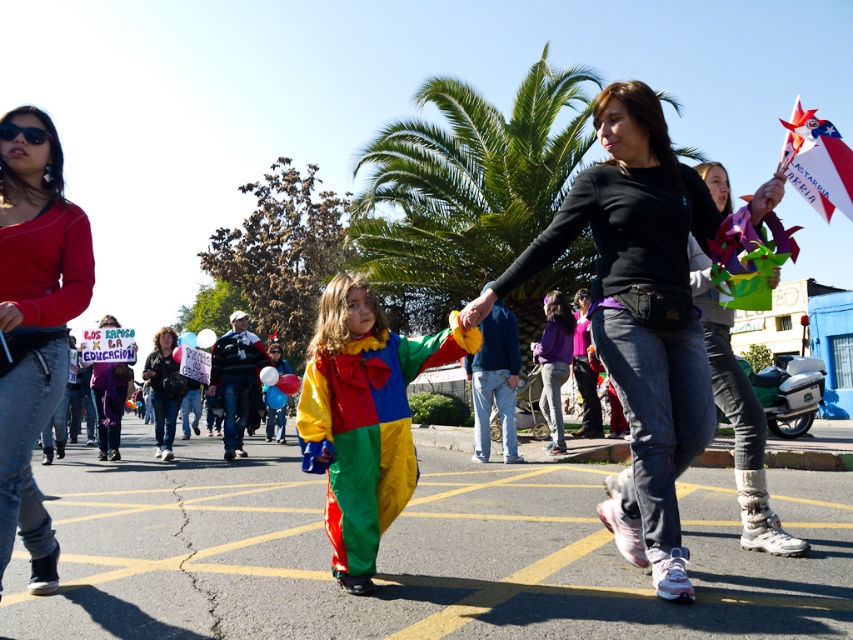
You are a photographer trying to capture a photo of the purple matte shirt at center and the matte black jacket at center. Since you want both subjects to be in focus, you need to know which one is taller. Can you tell me which is taller?

The purple matte shirt at center is taller than the matte black jacket at center.

You are a photographer trying to capture a clear photo of the matte clown costume at center without the multicolored fabric dress at center blocking it. Based on their positions, is this possible?

The matte clown costume at center is in front of the multicolored fabric dress at center, so it is possible to capture a clear photo of the matte clown costume at center without the multicolored fabric dress at center blocking it.

You are organizing a photo shoot and need to ensure that the purple matte shirt at center and the matte black jacket at center are visible in the frame. Based on their sizes, which one might require more space to fully capture in the photo?

The matte black jacket at center requires more space because it has a greater width than the purple matte shirt at center.